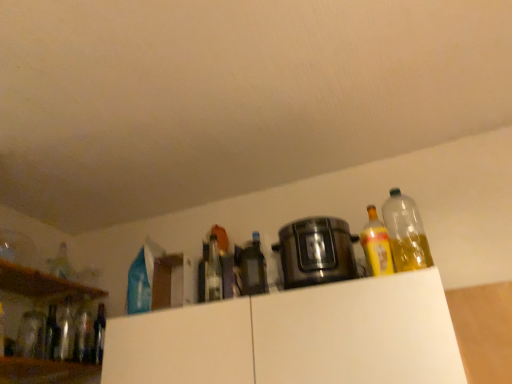
Question: In terms of height, does translucent glass bottle at left, the ninth bottle when ordered from right to left, look taller or shorter compared to white matte cabinet at upper center, arranged as the first cabinetry when viewed from the left?

Choices:
 (A) short
 (B) tall

Answer: (A)

Question: Is translucent glass bottle at left, which is counted as the first bottle, starting from the left, wider or thinner than white matte cabinet at upper center, arranged as the first cabinetry when viewed from the left?

Choices:
 (A) wide
 (B) thin

Answer: (B)

Question: Estimate the real-world distances between objects in this image. Which object is closer to the matte glass bottle at center, the 3th bottle in the right-to-left sequence?

Choices:
 (A) satin black slow cooker at center
 (B) white matte cabinet at upper center, which appears as the second cabinetry when viewed from the right
 (C) white matte cabinet at upper center, placed as the first cabinetry when sorted from right to left
 (D) matte glass bottles at left
 (E) translucent glass bottle at left, the eighth bottle viewed from the right

Answer: (A)

Question: Which object is positioned farthest from the white matte cabinet at upper center, arranged as the first cabinetry when viewed from the left?

Choices:
 (A) clear glass bottle at left, which is counted as the fifth bottle, starting from the right
 (B) transparent plastic bottle at upper right, the first bottle positioned from the right
 (C) clear glass bottle at center, the 6th bottle in the left-to-right sequence
 (D) white matte cabinet at upper center, which is the second cabinetry in left-to-right order
 (E) translucent glass bottle at left, the eighth bottle viewed from the right

Answer: (B)